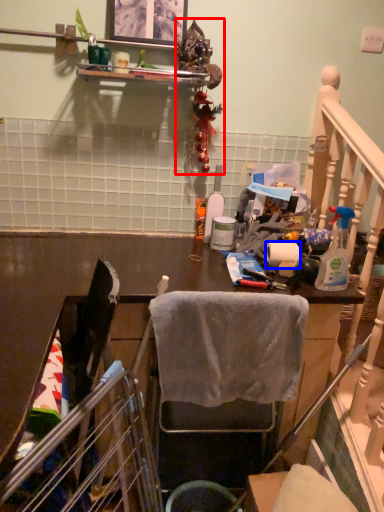
Question: Which of the following is the farthest to the observer, christmas decoration (highlighted by a red box) or toilet paper (highlighted by a blue box)?

Choices:
 (A) christmas decoration
 (B) toilet paper

Answer: (B)